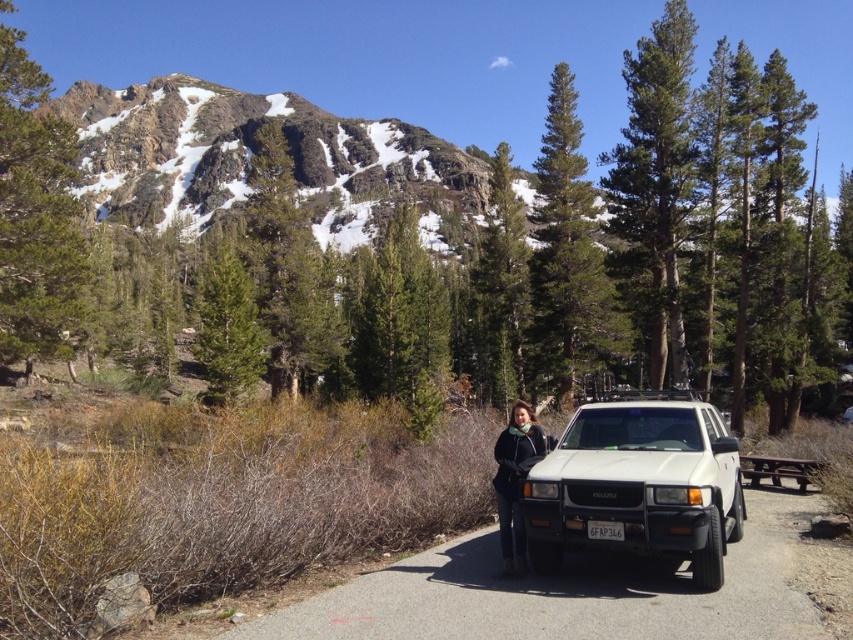
You are standing at the point closer to the camera between the two points, point (494, 484) and point (619, 524). Which point are you at?

You are at point (494, 484) since it is closer to the camera than point (619, 524).

You are standing at the point marked by the coordinates point (639, 484). Looking around, you see the white matte jeep at center. Which direction should you face to see the rugged mountainous landscape with patches of snow?

The rugged mountainous landscape with patches of snow is behind the white matte jeep at center, so you should face the direction opposite to the jeep to see it.